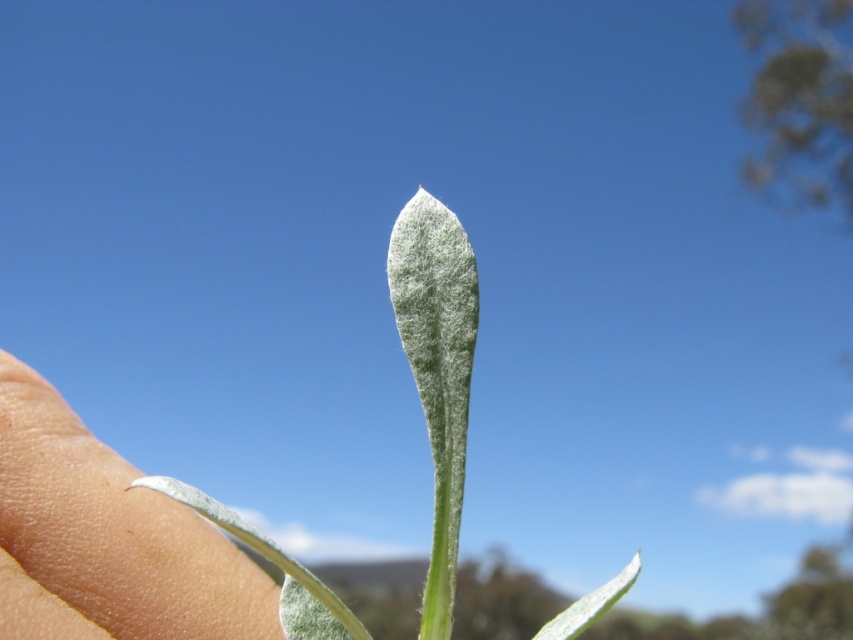
Question: Is white fuzzy leaf at lower left thinner than white fuzzy leaf at center?

Choices:
 (A) no
 (B) yes

Answer: (B)

Question: Observing the image, what is the correct spatial positioning of white fuzzy leaf at lower left in reference to white fuzzy leaf at center?

Choices:
 (A) below
 (B) above

Answer: (A)

Question: Is white fuzzy leaf at lower left closer to camera compared to white fuzzy leaf at center?

Choices:
 (A) no
 (B) yes

Answer: (A)